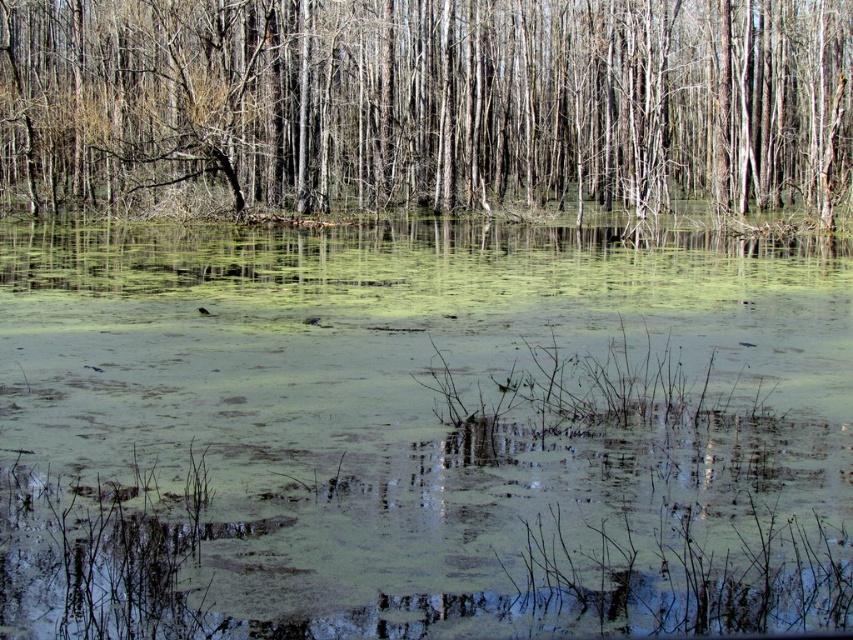
You are an environmental scientist assessing the health of a swamp. You observe the green algae water at center and the smooth bark tree at center. Which object occupies a smaller area in the scene?

The green algae water at center has a lesser width compared to the smooth bark tree at center, meaning it occupies a smaller area.

You are standing on a wooden platform that is 4 meters away from the green algae water at center. If you want to reach the water without getting your shoes wet, can you jump over the distance? Please explain your reasoning.

The green algae water at center is 3.97 meters away. Since the wooden platform is 4 meters away from the water, the distance is slightly less than the platform distance, so jumping over 3.97 meters might be possible for an athlete but not feasible for an average person. However, the question mentions not getting shoes wet, so jumping might splash water. A safer option is to step back to ensure no contact.

Consider the image. You are standing at the edge of the swamp and want to place a small boat on the green algae water at center. To avoid hitting the smooth bark tree at center, in which direction should you move the boat?

The green algae water at center is located below the smooth bark tree at center, so you should move the boat away from the direction of the smooth bark tree at center to avoid hitting it.